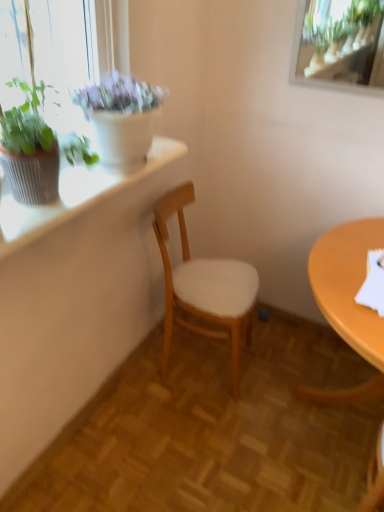
Locate an element on the screen. This screenshot has height=512, width=384. free location to the right of white woven wood chair at center is located at coordinates (271, 357).